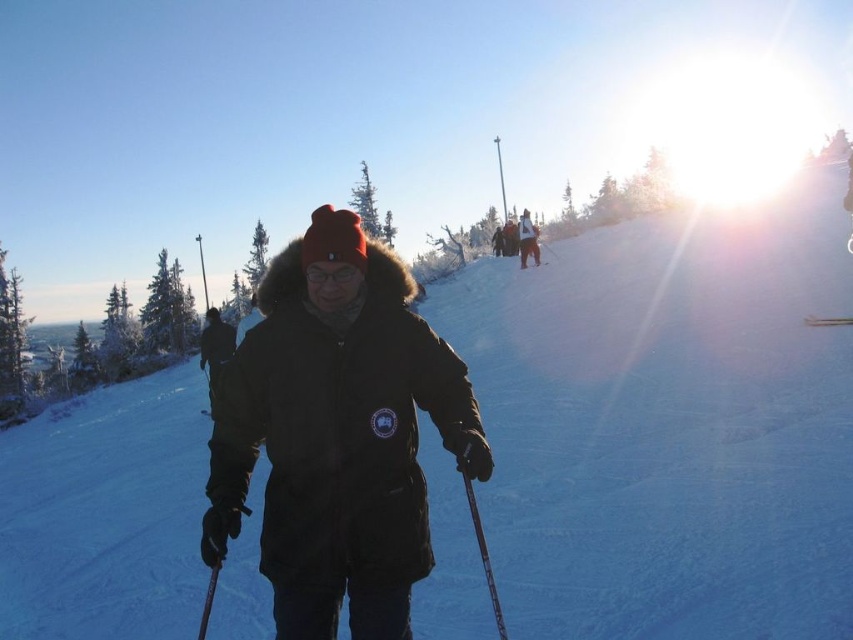
Question: Does metallic ski pole at center have a smaller size compared to matte black ski at upper center?

Choices:
 (A) no
 (B) yes

Answer: (B)

Question: Is black matte jacket at center thinner than matte black ski at upper center?

Choices:
 (A) yes
 (B) no

Answer: (B)

Question: Which point is closer to the camera?

Choices:
 (A) (469, 499)
 (B) (526, 250)
 (C) (306, 554)
 (D) (521, 260)

Answer: (A)

Question: Which point is farther to the camera?

Choices:
 (A) (521, 262)
 (B) (849, 324)
 (C) (532, 252)
 (D) (224, 545)

Answer: (C)

Question: Considering the real-world distances, which object is farthest from the white snowboard at upper center?

Choices:
 (A) black matte jacket at center
 (B) metallic silver ski at center
 (C) metallic ski pole at center

Answer: (C)

Question: Does white snowboard at upper center appear over metallic silver ski at center?

Choices:
 (A) yes
 (B) no

Answer: (A)